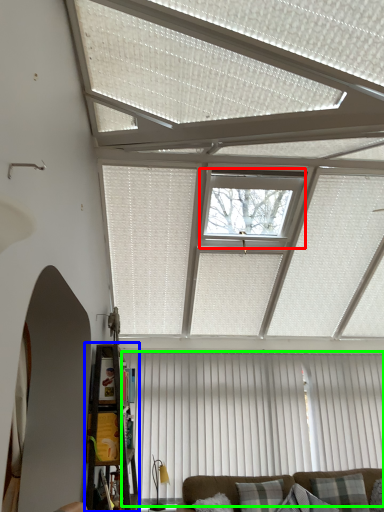
Question: Estimate the real-world distances between objects in this image. Which object is farther from window (highlighted by a red box), shelf (highlighted by a blue box) or curtain (highlighted by a green box)?

Choices:
 (A) shelf
 (B) curtain

Answer: (B)